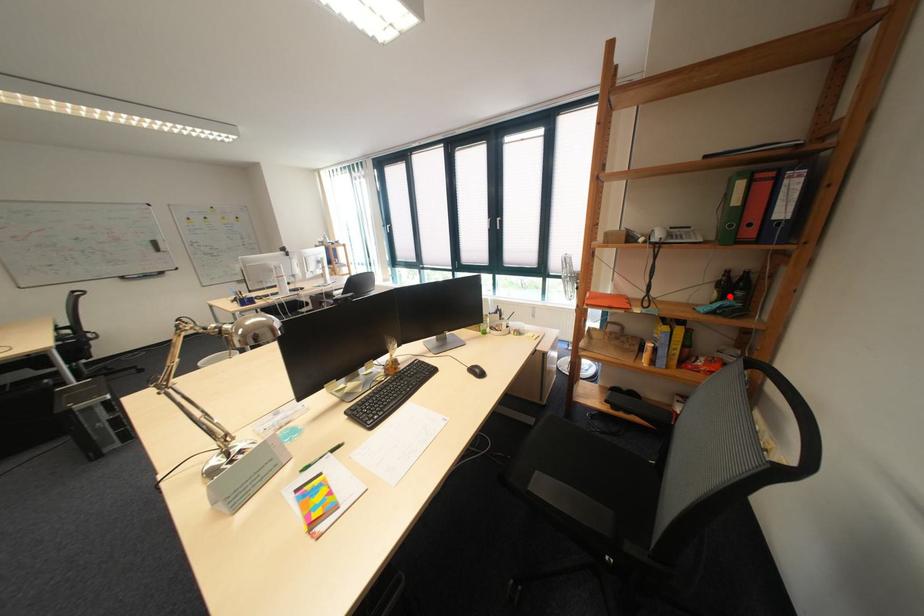
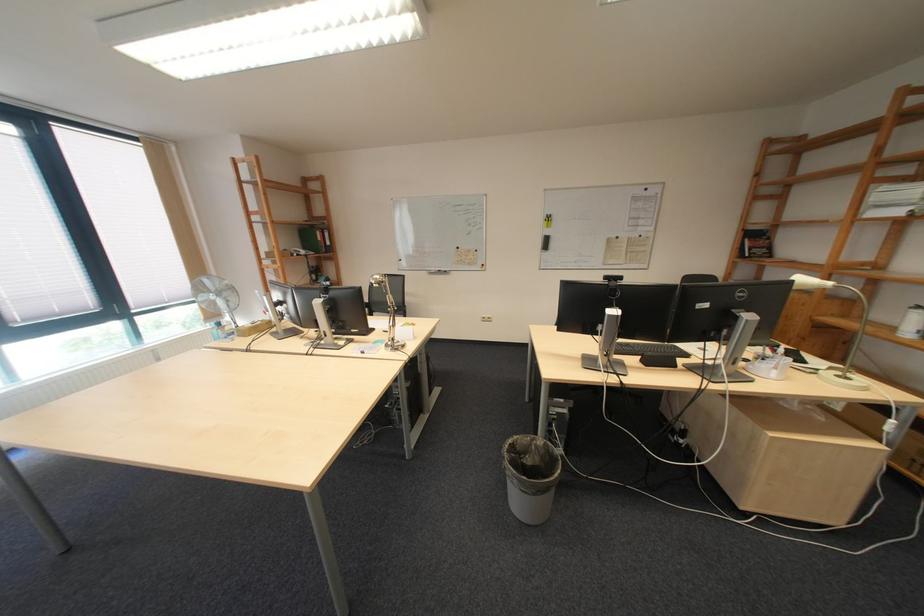
The point at the highlighted location is marked in the first image. Where is the corresponding point in the second image?

(329, 278)